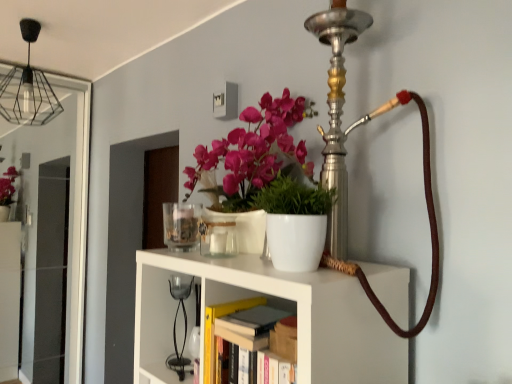
Question: In the image, is hardcover book at center, arranged as the third book when viewed from the back, on the left side or the right side of matte black light bulb at upper left?

Choices:
 (A) right
 (B) left

Answer: (A)

Question: Is hardcover book at center, positioned as the first book in front-to-back order, situated inside matte black light bulb at upper left or outside?

Choices:
 (A) outside
 (B) inside

Answer: (A)

Question: Considering the real-world distances, which object is closest to the matte black light bulb at upper left?

Choices:
 (A) black glass table lamp at center
 (B) transparent glass door at left
 (C) hardcover book at center, which is the 1th book from back to front
 (D) white matte shelf at center
 (E) transparent glass candle holder at upper center

Answer: (B)

Question: Which object is the closest to the transparent glass candle holder at upper center?

Choices:
 (A) hardcover book at center, which appears as the second book when viewed from the back
 (B) hardcover book at center, which is the third book in front-to-back order
 (C) matte black light bulb at upper left
 (D) hardcover book at center, arranged as the third book when viewed from the back
 (E) transparent glass door at left

Answer: (B)